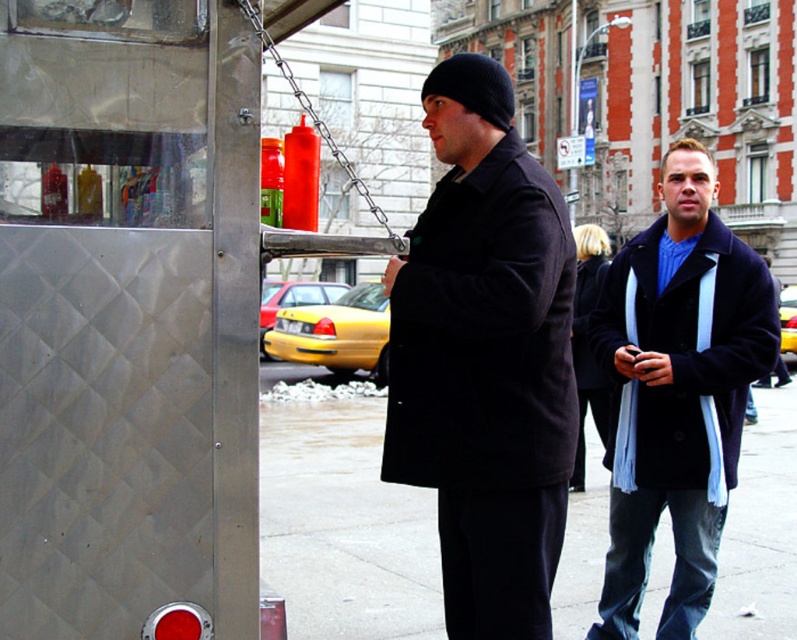
Is dark blue wool coat at right below yellow matte taxi at center?

Actually, dark blue wool coat at right is above yellow matte taxi at center.

Is the position of dark blue wool coat at right more distant than that of yellow matte taxi at center?

No, it is in front of yellow matte taxi at center.

The height and width of the screenshot is (640, 797). I want to click on dark blue wool coat at right, so click(677, 392).

This screenshot has height=640, width=797. Find the location of `dark blue wool coat at right`. dark blue wool coat at right is located at coordinates (677, 392).

Based on the photo, is concrete sidewalk at center taller than yellow matte taxi at center?

Incorrect, concrete sidewalk at center's height is not larger of yellow matte taxi at center's.

Does concrete sidewalk at center have a lesser width compared to yellow matte taxi at center?

No, concrete sidewalk at center is not thinner than yellow matte taxi at center.

Which is behind, point (778, 554) or point (338, 337)?

Point (338, 337)

The height and width of the screenshot is (640, 797). Find the location of `concrete sidewalk at center`. concrete sidewalk at center is located at coordinates (342, 520).

Looking at this image, which of these two, concrete sidewalk at center or dark blue wool coat at right, stands taller?

concrete sidewalk at center

Which is more to the left, concrete sidewalk at center or dark blue wool coat at right?

dark blue wool coat at right

Does point (772, 548) come in front of point (666, 304)?

That is False.

You are a GUI agent. You are given a task and a screenshot of the screen. Output one action in this format:
    pyautogui.click(x=<x>, y=<y>)
    Task: Click on the concrete sidewalk at center
    Image resolution: width=797 pixels, height=640 pixels.
    Given the screenshot: What is the action you would take?
    pyautogui.click(x=342, y=520)